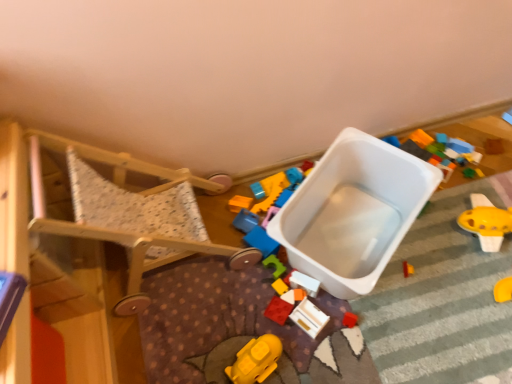
Locate an element on the screen. The width and height of the screenshot is (512, 384). vacant area that lies between yellow matte toy at lower center, placed as the 6th toy when sorted from right to left, and white plastic storage box at center is located at coordinates (281, 320).